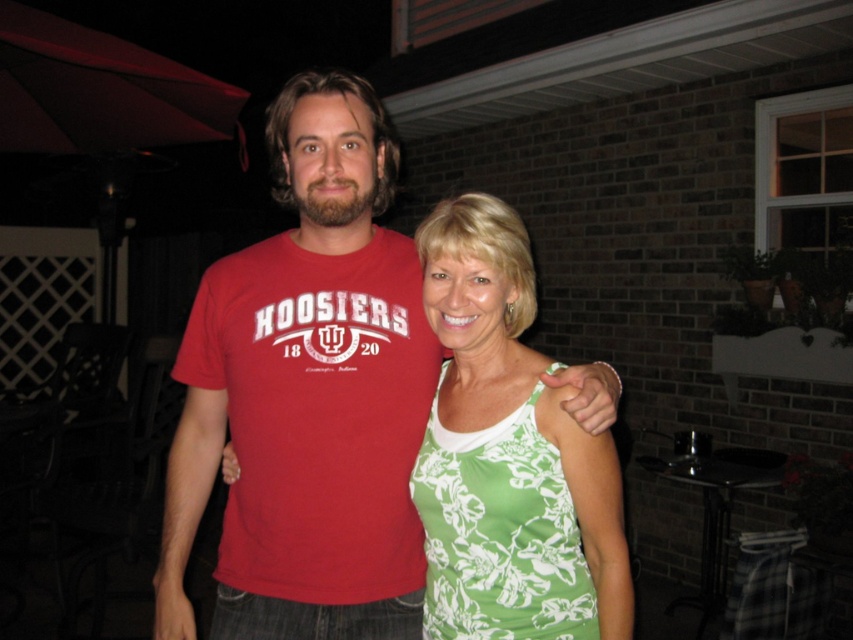
Who is positioned more to the left, matte red t-shirt at center or green floral tank top at center?

matte red t-shirt at center

Is matte red t-shirt at center taller than green floral tank top at center?

Correct, matte red t-shirt at center is much taller as green floral tank top at center.

The image size is (853, 640). What do you see at coordinates (306, 396) in the screenshot?
I see `matte red t-shirt at center` at bounding box center [306, 396].

Where is `matte red t-shirt at center`? The width and height of the screenshot is (853, 640). matte red t-shirt at center is located at coordinates (306, 396).